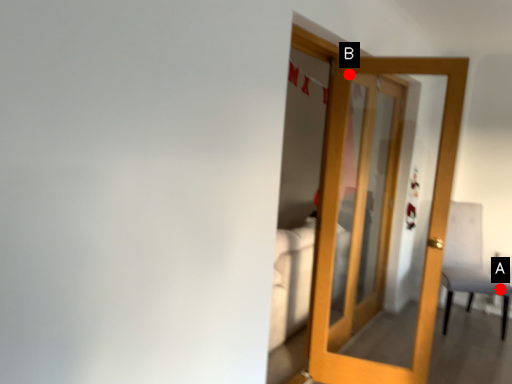
Question: Two points are circled on the image, labeled by A and B beside each circle. Among these points, which one is farthest from the camera?

Choices:
 (A) A is further
 (B) B is further

Answer: (A)